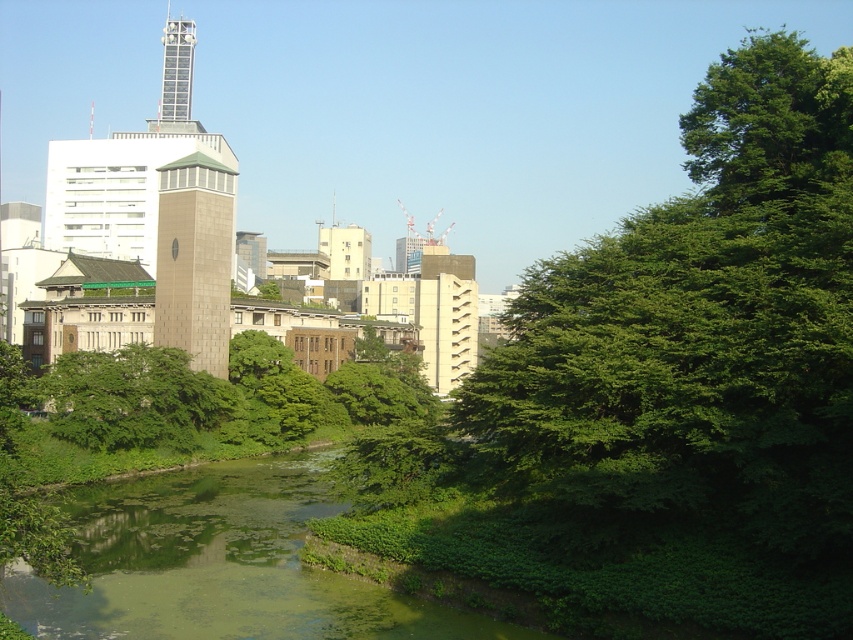
Question: Which object is closer to the camera taking this photo?

Choices:
 (A) metallic silver tower at upper center
 (B) beige textured tower at center
 (C) green leafy tree at center
 (D) green algae-covered water at lower center

Answer: (D)

Question: Which point is farther to the camera?

Choices:
 (A) metallic silver tower at upper center
 (B) beige textured tower at center
 (C) green leafy tree at center

Answer: (A)

Question: Observing the image, what is the correct spatial positioning of beige textured tower at center in reference to metallic silver tower at upper center?

Choices:
 (A) left
 (B) right

Answer: (B)

Question: Does green algae-covered water at lower center appear over metallic silver tower at upper center?

Choices:
 (A) yes
 (B) no

Answer: (B)

Question: Which point is closer to the camera?

Choices:
 (A) (230, 209)
 (B) (102, 356)
 (C) (178, 70)

Answer: (B)

Question: Is beige textured tower at center thinner than metallic silver tower at upper center?

Choices:
 (A) no
 (B) yes

Answer: (B)